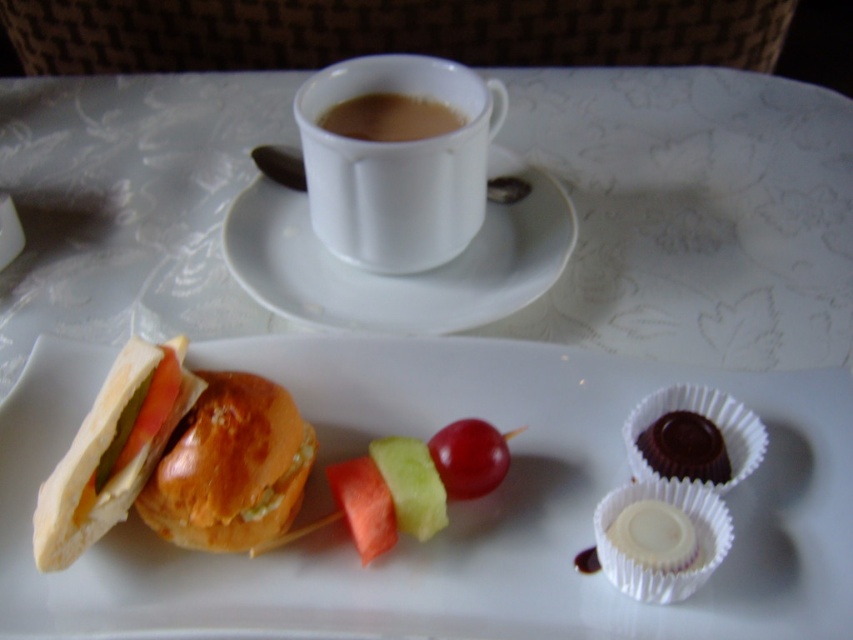
Question: Is red shiny grape at center smaller than orange fleshed at center?

Choices:
 (A) yes
 (B) no

Answer: (A)

Question: Is breadgolden brownsandwich at center below orange fleshed at center?

Choices:
 (A) no
 (B) yes

Answer: (A)

Question: Which of the following is the closest to the observer?

Choices:
 (A) (276, 467)
 (B) (593, 518)

Answer: (A)

Question: Which of the following is the farthest from the observer?

Choices:
 (A) smooth chocolate cupcake at lower right
 (B) breadgolden brownsandwich at center
 (C) golden crisp bread at lower left
 (D) white chocolate candy at lower right

Answer: (A)

Question: Among these points, which one is farthest from the camera?

Choices:
 (A) (332, 385)
 (B) (219, 529)
 (C) (630, 442)
 (D) (432, 529)

Answer: (A)

Question: Does white chocolate cupcake at lower right appear on the right side of smooth chocolate cupcake at lower right?

Choices:
 (A) yes
 (B) no

Answer: (B)